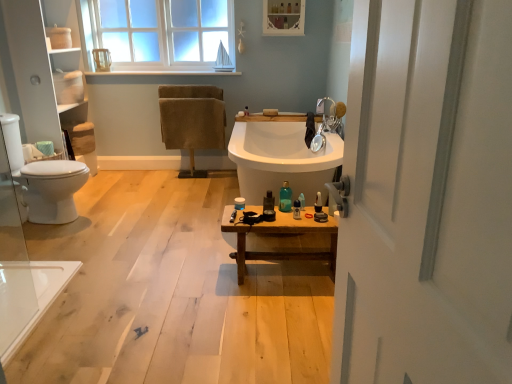
What are the coordinates of `free point behind white glossy toilet at left` in the screenshot? It's located at (100, 192).